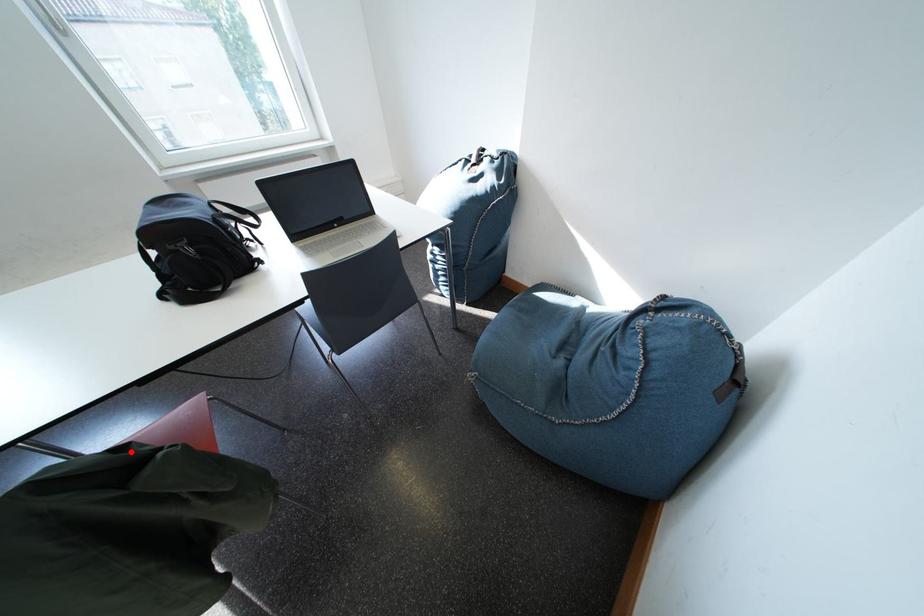
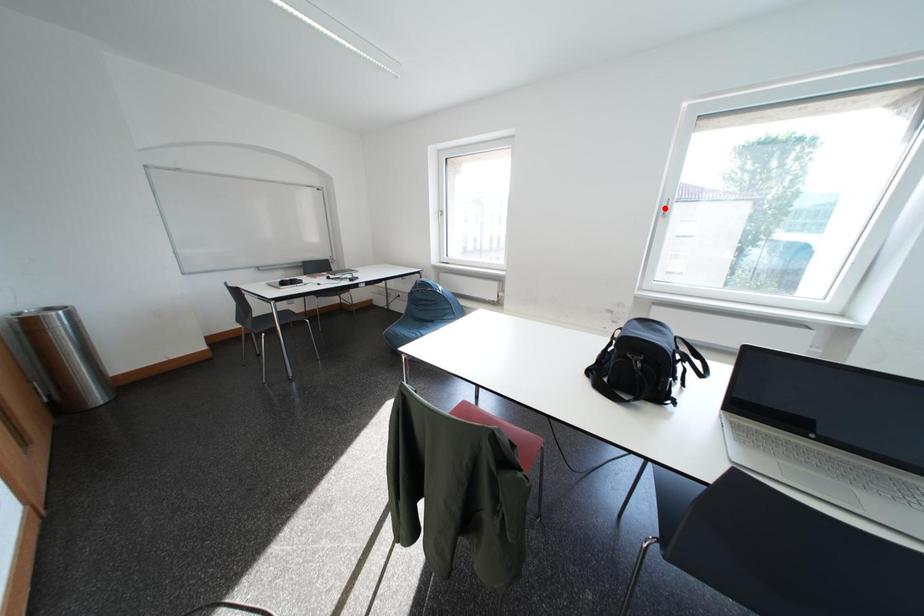
I am providing you with two images of the same scene from different viewpoints. A red point is marked on the first image and another point is marked on the second image. Does the point marked in image1 correspond to the same location as the one in image2?

No